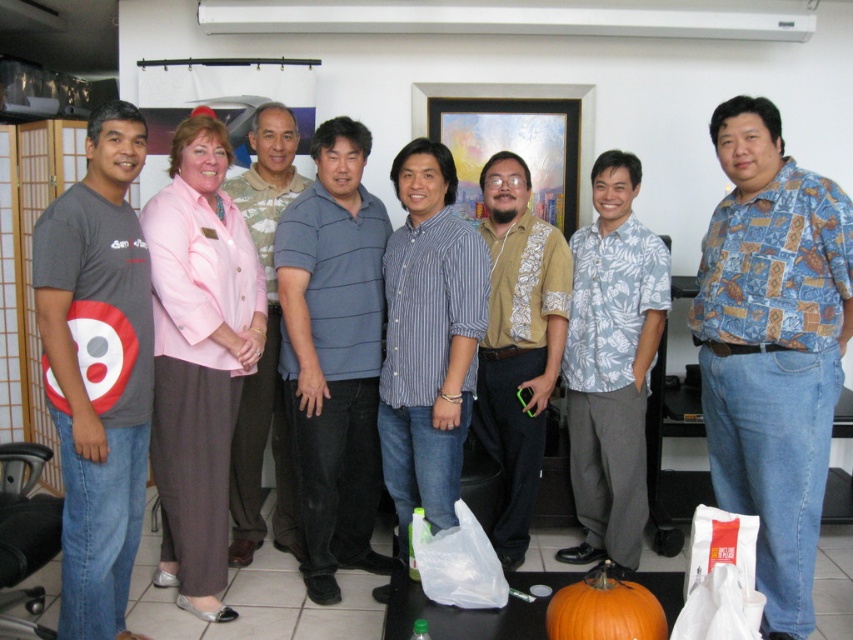
From the picture: You are standing in the room and want to find the blue striped polo shirt at center. Based on the coordinates provided, can you estimate where it is located in the room?

The blue striped polo shirt at center is located at coordinates approximately 0.556 on the x axis and 0.392 on the y axis, which would place it near the center of the room.

You are standing at the entrance of the room and want to greet the person wearing the blue striped polo shirt at center. Based on their position in the room, in which general direction should you walk to reach them?

The blue striped polo shirt at center is located at point 0.556 on the x axis and 0.392 on the y axis. Since you are at the entrance, you should walk towards the center of the room to reach them.